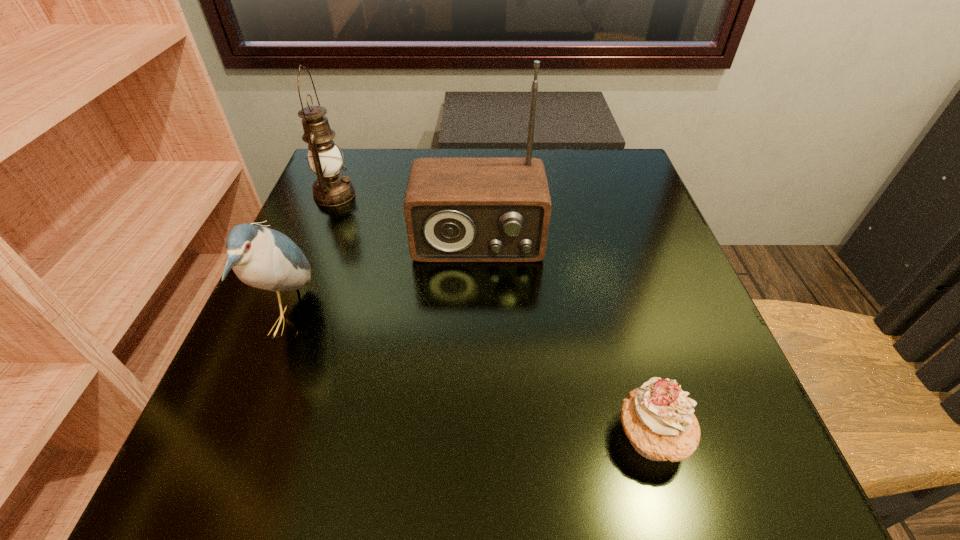
At what (x,y) coordinates should I click in order to perform the action: click on free space located 0.100m at the tip of the bird's beak. Please return your answer as a coordinate pair (x, y). Looking at the image, I should click on (372, 321).

This screenshot has height=540, width=960. Identify the location of blank space located 0.130m on the left of the shortest object. click(521, 437).

Locate an element on the screen. This screenshot has width=960, height=540. object that is at the far edge is located at coordinates (331, 188).

Where is `object at the near edge`? Image resolution: width=960 pixels, height=540 pixels. object at the near edge is located at coordinates (658, 419).

Locate an element on the screen. The image size is (960, 540). oil lamp that is at the left edge is located at coordinates (331, 188).

At what (x,y) coordinates should I click in order to perform the action: click on bird located at the left edge. Please return your answer as a coordinate pair (x, y). The image size is (960, 540). Looking at the image, I should click on (261, 257).

Where is `object positioned at the right edge`? object positioned at the right edge is located at coordinates (658, 419).

Find the location of a particular element. object that is at the far left corner is located at coordinates (331, 188).

Locate an element on the screen. The image size is (960, 540). object that is positioned at the near right corner is located at coordinates (658, 419).

Locate an element on the screen. The width and height of the screenshot is (960, 540). vacant space at the far edge is located at coordinates (556, 170).